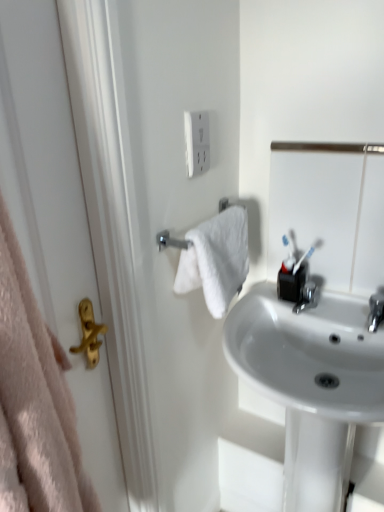
Question: From the image's perspective, is matte gold handle at left below silver metallic towel rack at center-left?

Choices:
 (A) yes
 (B) no

Answer: (A)

Question: Is matte gold handle at left positioned behind silver metallic towel rack at center-left?

Choices:
 (A) no
 (B) yes

Answer: (A)

Question: Is matte gold handle at left far from silver metallic towel rack at center-left?

Choices:
 (A) yes
 (B) no

Answer: (B)

Question: Does matte gold handle at left have a larger size compared to silver metallic towel rack at center-left?

Choices:
 (A) yes
 (B) no

Answer: (A)

Question: Is matte gold handle at left positioned in front of silver metallic towel rack at center-left?

Choices:
 (A) yes
 (B) no

Answer: (A)

Question: From a real-world perspective, is metallic silver mirror at upper right positioned above or below silver metallic towel rack at center-left?

Choices:
 (A) above
 (B) below

Answer: (B)

Question: Is metallic silver mirror at upper right wider or thinner than silver metallic towel rack at center-left?

Choices:
 (A) thin
 (B) wide

Answer: (A)

Question: From the image's perspective, is metallic silver mirror at upper right located above or below silver metallic towel rack at center-left?

Choices:
 (A) below
 (B) above

Answer: (B)

Question: In terms of height, does metallic silver mirror at upper right look taller or shorter compared to silver metallic towel rack at center-left?

Choices:
 (A) tall
 (B) short

Answer: (A)

Question: In the image, is metallic silver mirror at upper right on the left side or the right side of white glossy sink at center?

Choices:
 (A) right
 (B) left

Answer: (A)

Question: From their relative heights in the image, would you say metallic silver mirror at upper right is taller or shorter than white glossy sink at center?

Choices:
 (A) short
 (B) tall

Answer: (A)

Question: From a real-world perspective, is metallic silver mirror at upper right physically located above or below white glossy sink at center?

Choices:
 (A) below
 (B) above

Answer: (B)

Question: In the image, is metallic silver mirror at upper right positioned in front of or behind white glossy sink at center?

Choices:
 (A) behind
 (B) front

Answer: (A)

Question: From a real-world perspective, is white glossy sink at center physically located above or below metallic silver mirror at upper right?

Choices:
 (A) above
 (B) below

Answer: (B)

Question: Considering the relative positions of white glossy sink at center and metallic silver mirror at upper right in the image provided, is white glossy sink at center to the left or to the right of metallic silver mirror at upper right?

Choices:
 (A) right
 (B) left

Answer: (B)